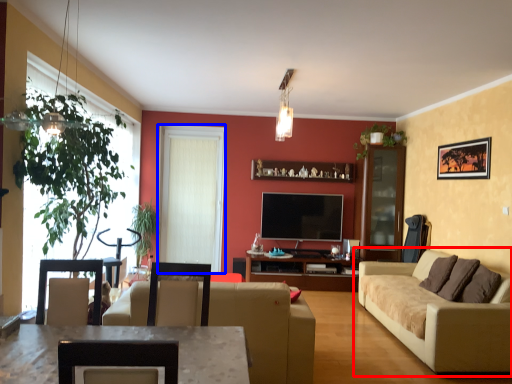
Question: Which of the following is the closest to the observer, studio couch (highlighted by a red box) or window screen (highlighted by a blue box)?

Choices:
 (A) studio couch
 (B) window screen

Answer: (A)